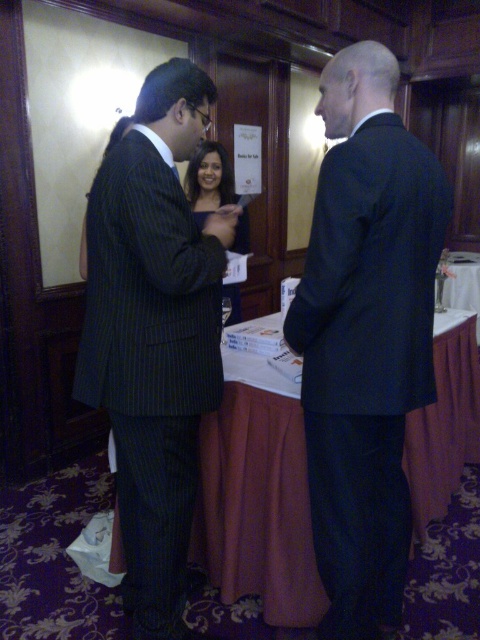
Can you confirm if white paper at center is positioned below matte black dress at center?

Yes.

This screenshot has width=480, height=640. Describe the element at coordinates (256, 497) in the screenshot. I see `white paper at center` at that location.

Does point (456, 380) come behind point (197, 202)?

That is False.

You are a GUI agent. You are given a task and a screenshot of the screen. Output one action in this format:
    pyautogui.click(x=<x>, y=<y>)
    Task: Click on the white paper at center
    
    Given the screenshot: What is the action you would take?
    point(256,497)

Which is below, dark pinstripe suit at left or matte black dress at center?

dark pinstripe suit at left is lower down.

Where is `dark pinstripe suit at left`? This screenshot has height=640, width=480. dark pinstripe suit at left is located at coordinates (155, 333).

Who is more forward, (417,179) or (447,358)?

Point (417,179) is in front.

Can you confirm if black smooth suit at center is positioned to the left of white paper at center?

Indeed, black smooth suit at center is positioned on the left side of white paper at center.

Does point (315, 513) come behind point (233, 547)?

No, (315, 513) is in front of (233, 547).

Find the location of `black smooth suit at center`. black smooth suit at center is located at coordinates (365, 337).